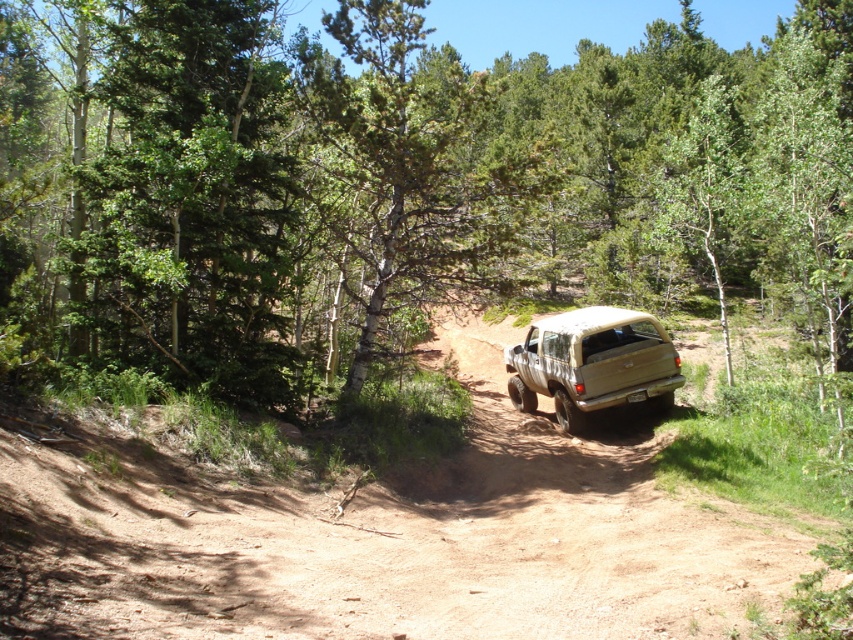
You are driving a beige matte truck at center on a brown dirt track at center. You need to pass a truck coming from the opposite direction. Do you think you can safely pull over to the side of the track to let them pass?

The brown dirt track at center might be wider than beige matte truck at center, so there is a possibility that the track has enough space for both vehicles to pass each other safely. However, since the width comparison is uncertain, it would be wise to proceed with caution and assess the situation before attempting to pass.

You are a hiker standing on the brown dirt track at center and looking towards the green leafy tree at center. Which object is closer to you?

The green leafy tree at center is closer to you because it is positioned further to the viewer than the brown dirt track at center, meaning it appears nearer in the scene.

You are a hiker trying to follow the brown dirt track at center through the forest. There is a green leafy tree at center blocking your path. Which direction should you go to stay on the track?

The green leafy tree at center is to the left of the brown dirt track at center, so you should go to the right of the tree to stay on the track.